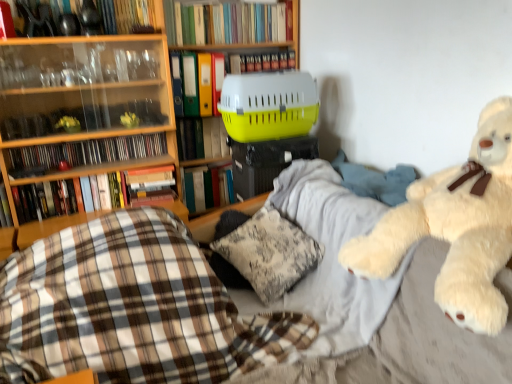
Find the location of a particular element. This screenshot has width=512, height=384. vacant area on top of hardcover book at upper center, positioned as the 7th book in bottom-to-top order (from a real-world perspective) is located at coordinates (261, 49).